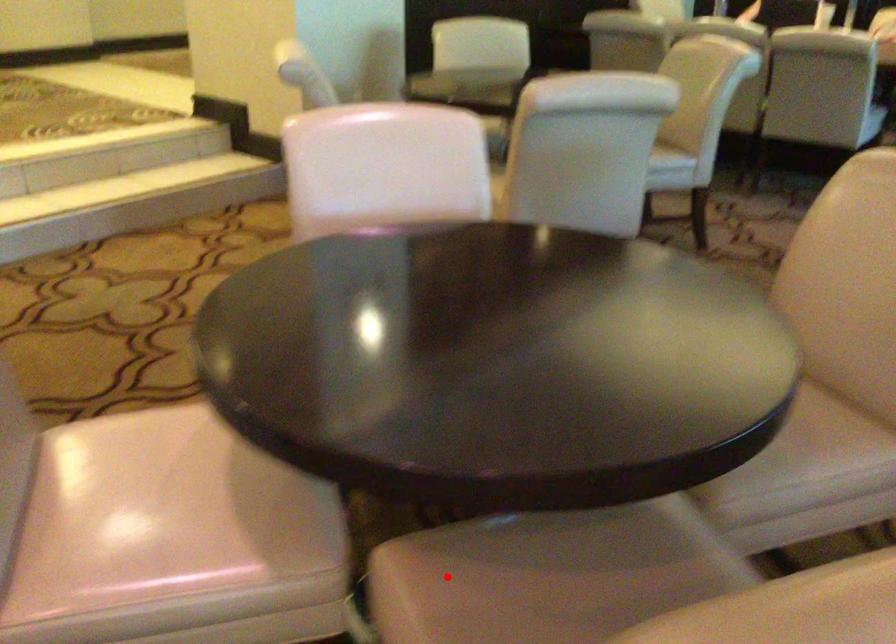
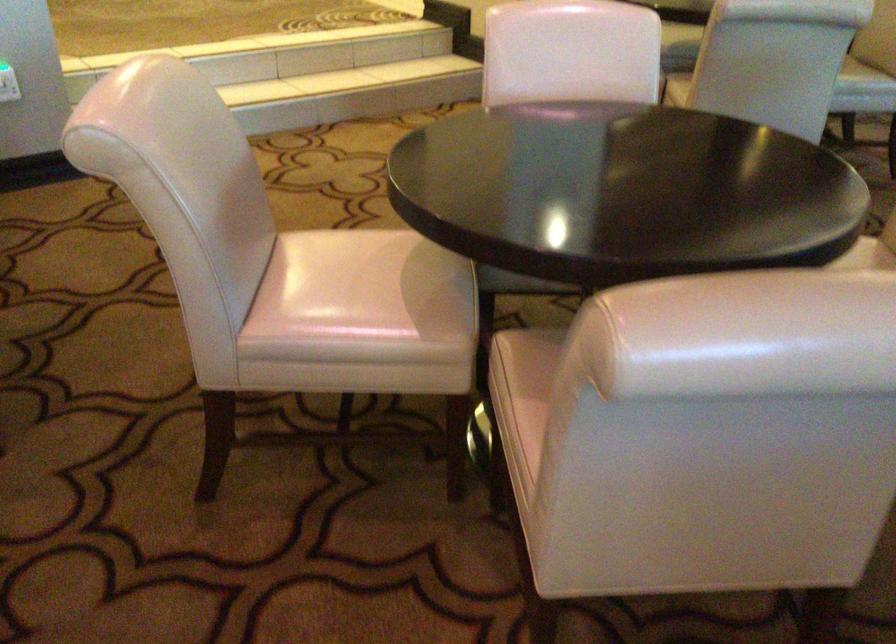
The point at the highlighted location is marked in the first image. Where is the corresponding point in the second image?

(538, 351)